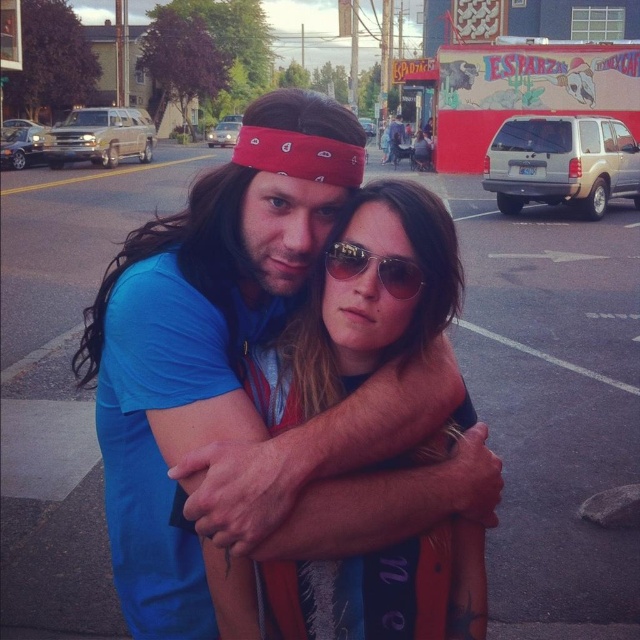
You are a photographer trying to capture a closeup of the sunglasses at center without including the matte blue shirt at center in the frame. Given their sizes, is this possible?

The matte blue shirt at center is bigger than sunglasses at center. Since the shirt is larger, it might block the view of the sunglasses unless you angle the camera to focus solely on the sunglasses while avoiding the shirt.

Based on the photo, you are a photographer trying to capture a closeup of the matte blue shirt at center. Based on the scene description, where should you position your camera relative to the two individuals?

The matte blue shirt at center is located at point (362, 305), so you should position your camera directly in front of the shirt to capture the closeup.